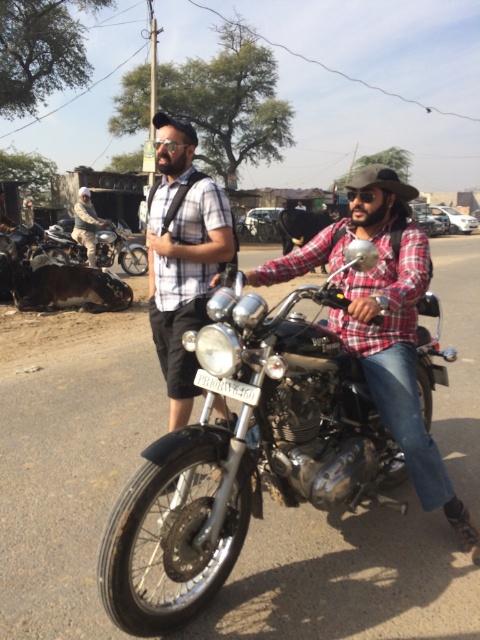
Question: Does matte black shirt at center have a greater width compared to shiny chrome motorcycle at left?

Choices:
 (A) yes
 (B) no

Answer: (B)

Question: Which object is positioned closest to the matte black helmet at upper left?

Choices:
 (A) matte black shirt at center
 (B) plaid shirt at center
 (C) shiny chrome motorcycle at center
 (D) shiny chrome motorcycle at left

Answer: (D)

Question: Which object is the closest to the shiny chrome motorcycle at left?

Choices:
 (A) shiny chrome motorcycle at center
 (B) matte black shirt at center

Answer: (B)

Question: Does matte black shirt at center appear under matte black helmet at upper left?

Choices:
 (A) yes
 (B) no

Answer: (A)

Question: Is shiny chrome motorcycle at center bigger than matte black helmet at upper left?

Choices:
 (A) no
 (B) yes

Answer: (B)

Question: Among these points, which one is nearest to the camera?

Choices:
 (A) click(x=348, y=252)
 (B) click(x=155, y=200)
 (C) click(x=119, y=253)

Answer: (A)